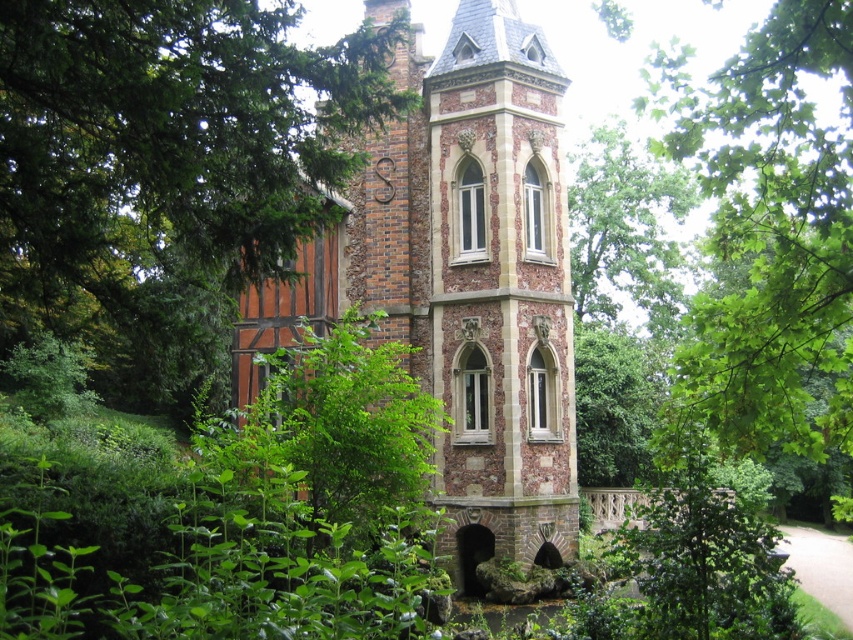
Question: Is brick tower at center positioned behind green leafy tree at upper center?

Choices:
 (A) yes
 (B) no

Answer: (A)

Question: Does brick tower at center lie behind green leafy tree at upper center?

Choices:
 (A) no
 (B) yes

Answer: (B)

Question: Which point is closer to the camera taking this photo?

Choices:
 (A) (337, 250)
 (B) (834, 4)

Answer: (B)

Question: Is brick tower at center positioned at the back of green leafy tree at upper center?

Choices:
 (A) no
 (B) yes

Answer: (B)

Question: Which point is farther to the camera?

Choices:
 (A) (799, 42)
 (B) (556, 541)

Answer: (B)